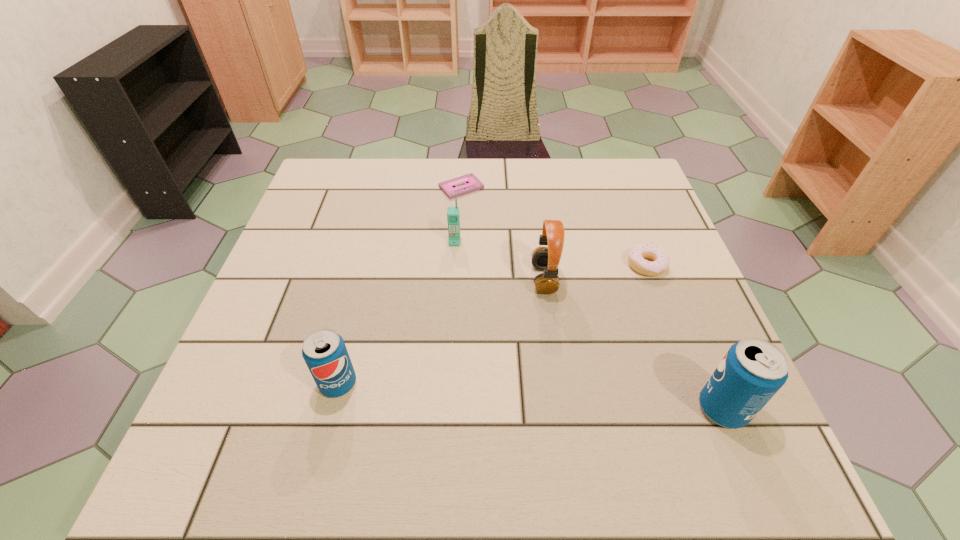
This screenshot has height=540, width=960. Find the location of `vacant space at the far edge of the desktop`. vacant space at the far edge of the desktop is located at coordinates (532, 176).

In the image, there is a desktop. In order to click on vacant space at the near edge in this screenshot , I will do `click(404, 396)`.

You are a GUI agent. You are given a task and a screenshot of the screen. Output one action in this format:
    pyautogui.click(x=<x>, y=<y>)
    Task: Click on the vacant space at the left edge of the desktop
    The image size is (960, 540).
    Given the screenshot: What is the action you would take?
    pyautogui.click(x=309, y=238)

Locate an element on the screen. This screenshot has width=960, height=540. free location at the right edge is located at coordinates (654, 240).

Identify the location of vacant space at the far left corner of the desktop. (348, 193).

What are the coordinates of `free region at the near left corner of the desktop` in the screenshot? It's located at (239, 401).

Locate an element on the screen. free space at the far right corner is located at coordinates (591, 180).

The image size is (960, 540). Find the location of `vacant space that is in between the doughnut and the fourth object from left to right`. vacant space that is in between the doughnut and the fourth object from left to right is located at coordinates (595, 272).

Image resolution: width=960 pixels, height=540 pixels. Identify the location of vacant area that lies between the right soda can and the shorter soda can. (531, 396).

You are a GUI agent. You are given a task and a screenshot of the screen. Output one action in this format:
    pyautogui.click(x=<x>, y=<y>)
    Task: Click on the free space that is in between the second shortest object and the shorter soda can
    This screenshot has width=960, height=540.
    Given the screenshot: What is the action you would take?
    pyautogui.click(x=492, y=325)